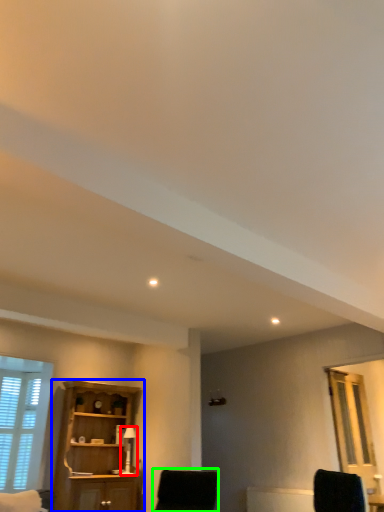
Question: Which object is the farthest from table lamp (highlighted by a red box)? Choose among these: cupboard (highlighted by a blue box) or chair (highlighted by a green box).

Choices:
 (A) cupboard
 (B) chair

Answer: (B)